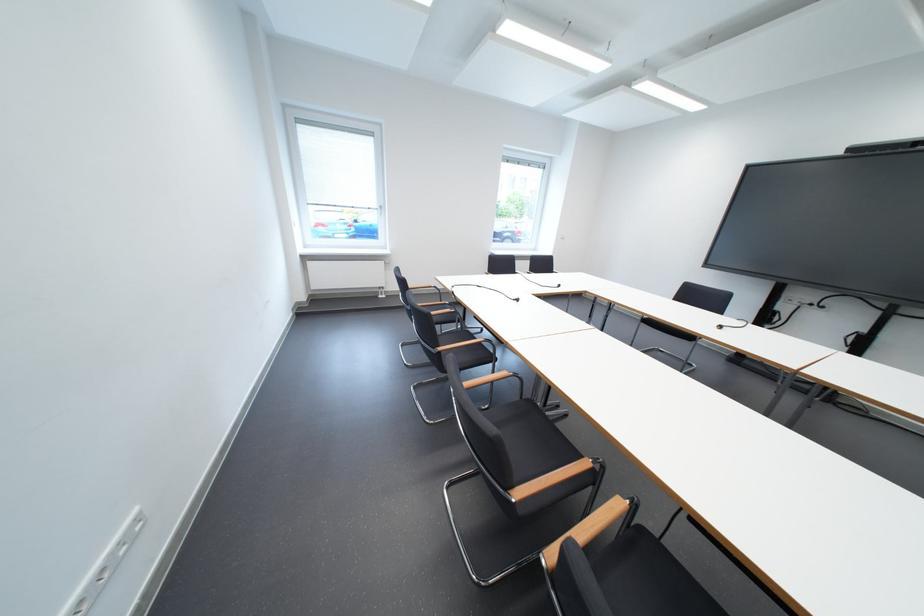
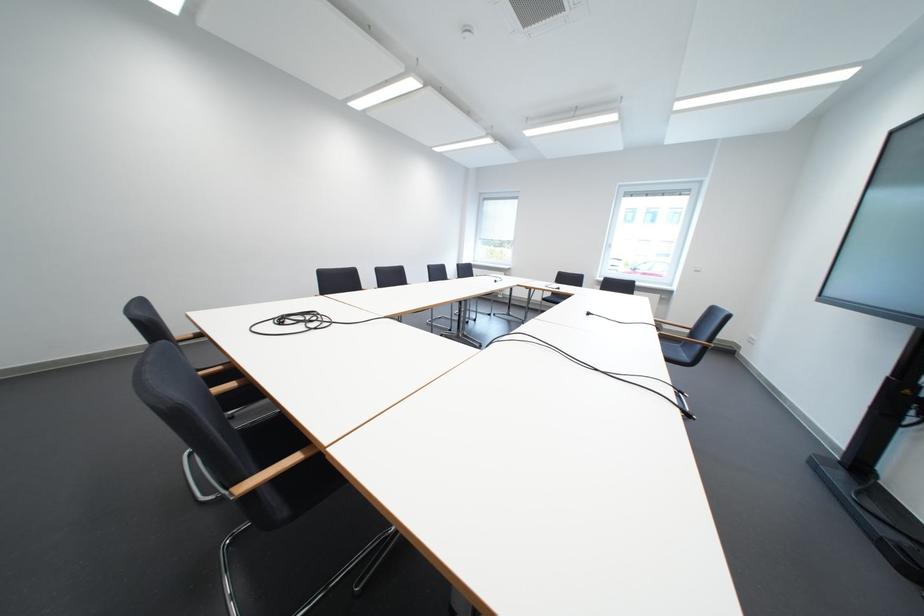
Locate, in the second image, the point that corresponds to [733,329] in the first image.

(601, 315)